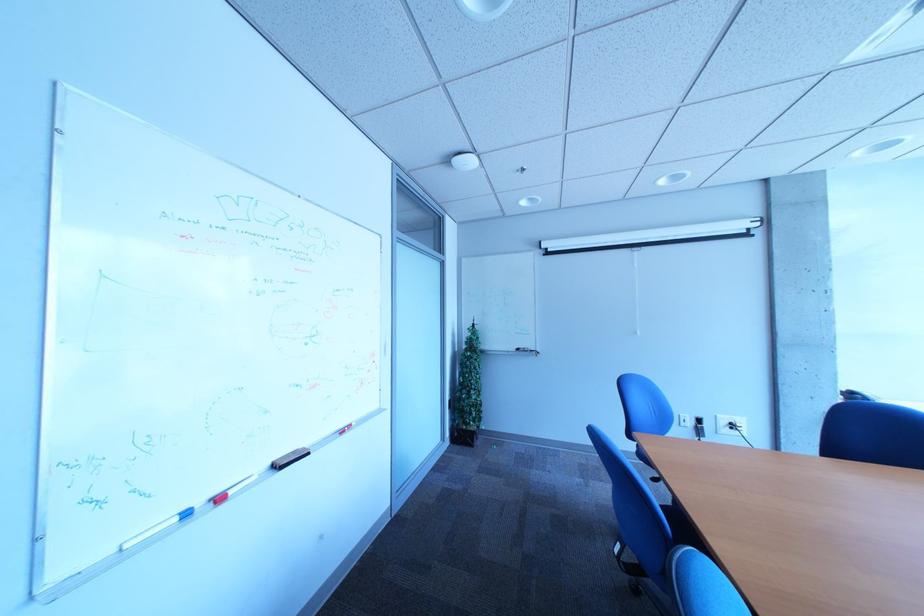
Where is `red whiteboard marker`? Image resolution: width=924 pixels, height=616 pixels. red whiteboard marker is located at coordinates (232, 490).